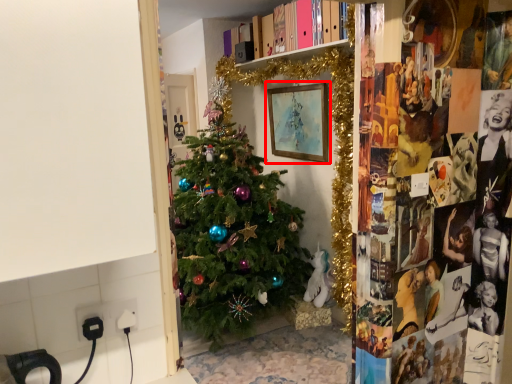
Question: From the image's perspective, what is the correct spatial positioning of picture frame (annotated by the red box) in reference to electric outlet?

Choices:
 (A) above
 (B) below

Answer: (A)